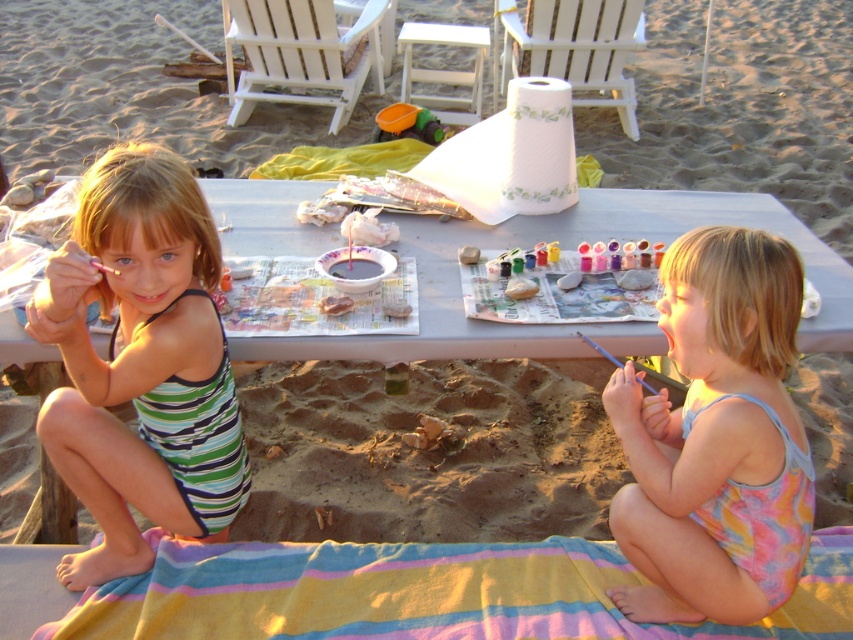
Between point (343, 628) and point (97, 260), which one is positioned in front?

Positioned in front is point (97, 260).

Does striped cotton towel at lower center have a smaller size compared to matte pink paintbrush at upper left?

No.

The width and height of the screenshot is (853, 640). Describe the element at coordinates (421, 593) in the screenshot. I see `striped cotton towel at lower center` at that location.

Where is `striped cotton towel at lower center`? This screenshot has height=640, width=853. striped cotton towel at lower center is located at coordinates (421, 593).

Is white plastic picnic table at center positioned at the back of striped cotton towel at lower center?

Yes, white plastic picnic table at center is further from the viewer.

Identify the location of white plastic picnic table at center. The image size is (853, 640). (427, 452).

Who is more distant from viewer, [752,618] or [109,268]?

Positioned behind is point [752,618].

Describe the element at coordinates (717, 438) in the screenshot. I see `pastel tie-dye swimsuit at lower right` at that location.

The image size is (853, 640). Identify the location of pastel tie-dye swimsuit at lower right. (717, 438).